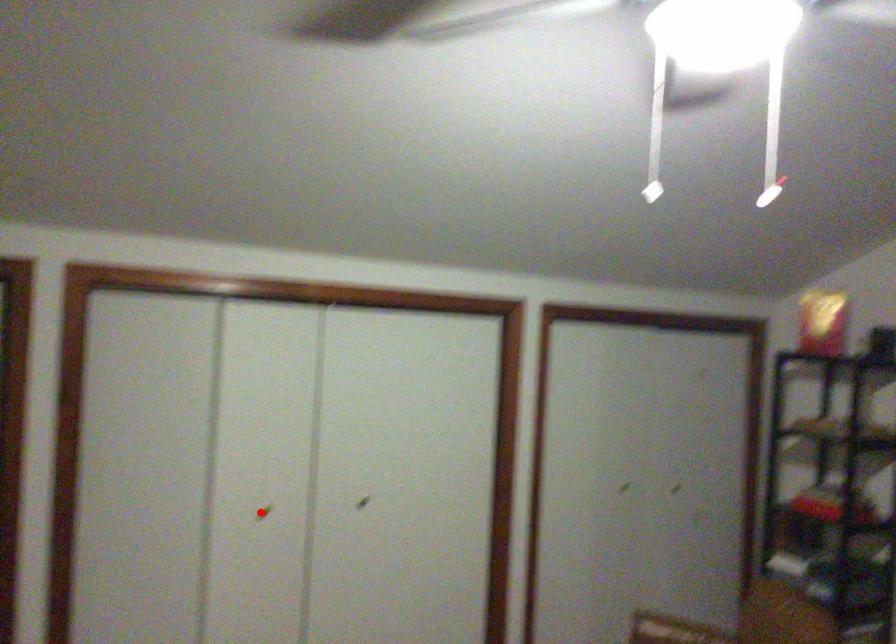
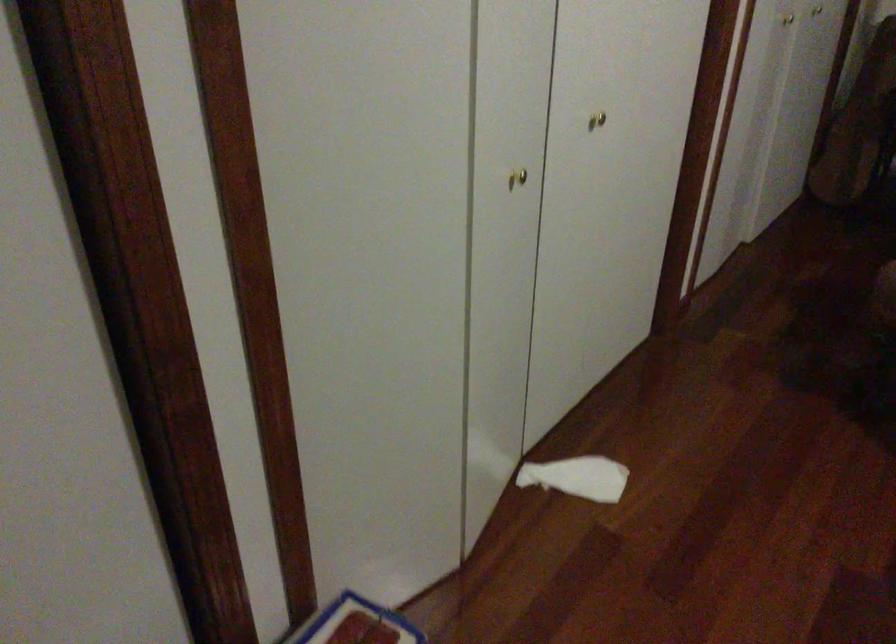
Question: I am providing you with two images of the same scene from different viewpoints. A red point is marked on the first image. At the location where the point appears in image 1, is it still visible in image 2?

Choices:
 (A) Yes
 (B) No

Answer: (A)